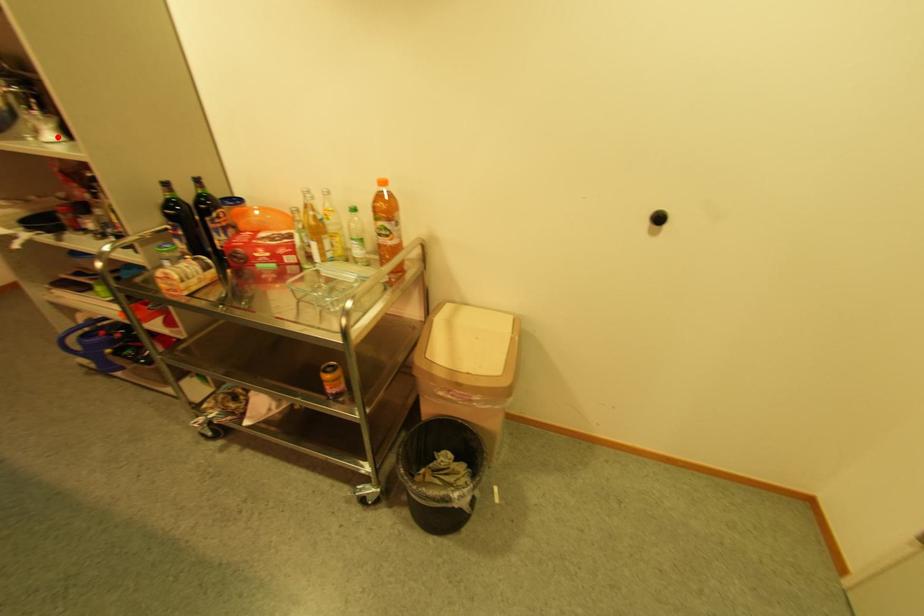
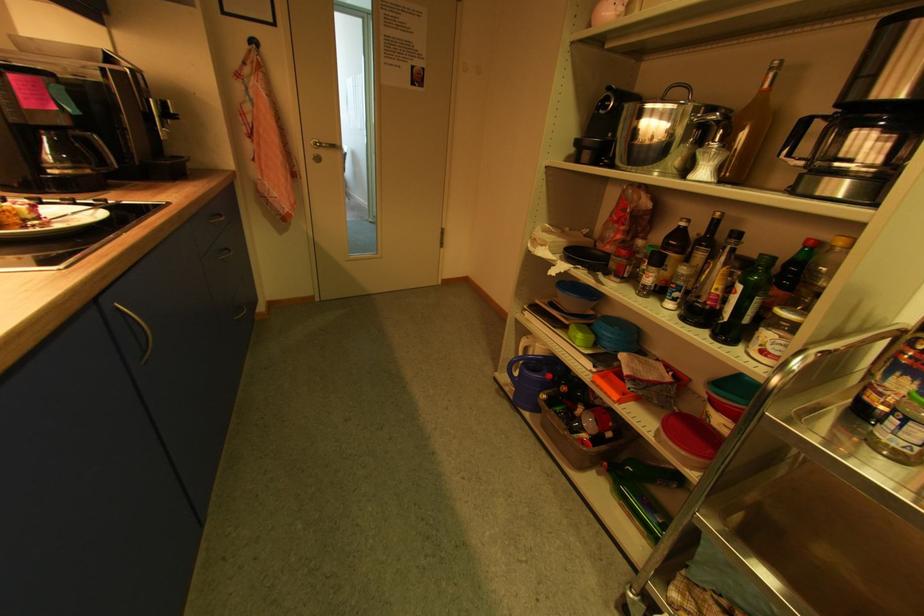
Question: I am providing you with two images of the same scene from different viewpoints. A red point is marked on the first image. Can you still see the location of the red point in image 2?

Choices:
 (A) Yes
 (B) No

Answer: (A)